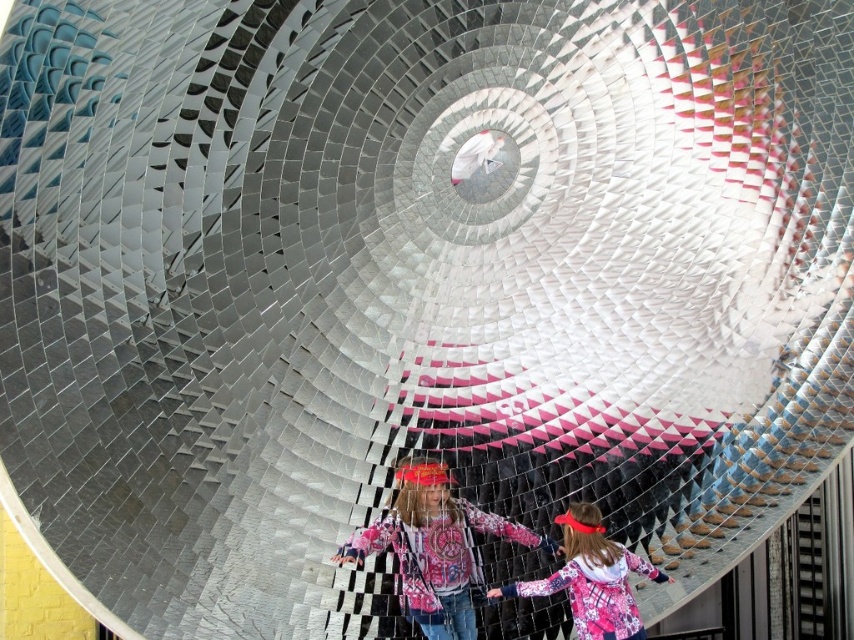
Question: Does plaid fabric shirt at center have a lesser width compared to plaid fabric hoodie at center?

Choices:
 (A) yes
 (B) no

Answer: (B)

Question: Which object is farther from the camera taking this photo?

Choices:
 (A) plaid fabric hoodie at center
 (B) plaid fabric shirt at center

Answer: (A)

Question: Which point is farther to the camera?

Choices:
 (A) (431, 560)
 (B) (640, 570)

Answer: (B)

Question: Does plaid fabric shirt at center have a larger size compared to plaid fabric hoodie at center?

Choices:
 (A) yes
 (B) no

Answer: (A)

Question: In this image, where is plaid fabric shirt at center located relative to plaid fabric hoodie at center?

Choices:
 (A) right
 (B) left

Answer: (B)

Question: Which point is farther to the camera?

Choices:
 (A) plaid fabric hoodie at center
 (B) plaid fabric shirt at center

Answer: (A)